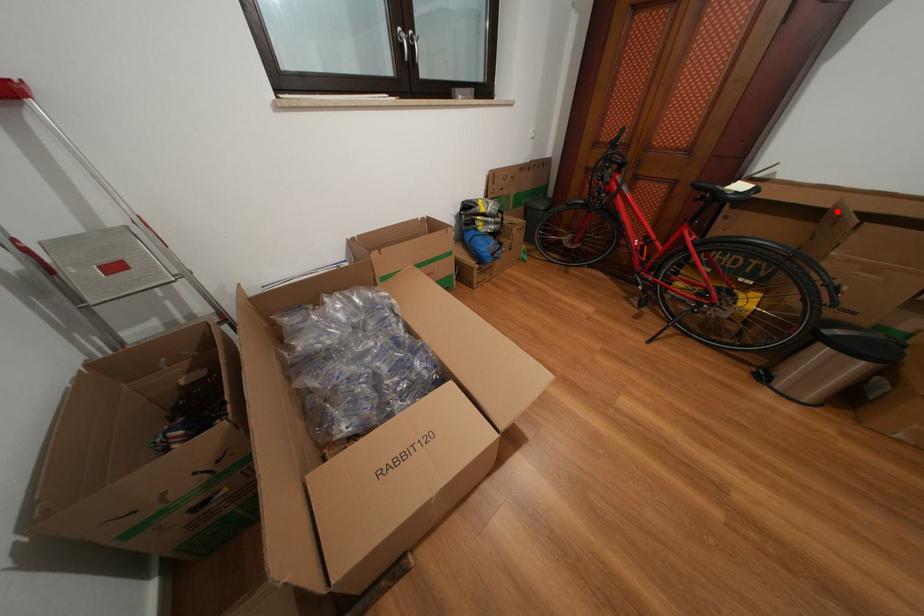
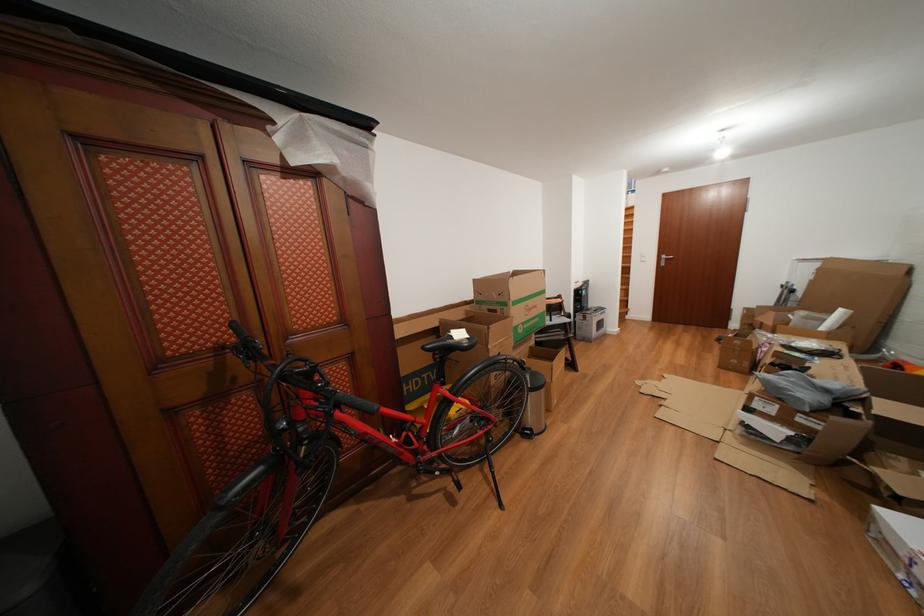
Question: I am providing you with two images of the same scene from different viewpoints. In image1, a red point is highlighted. Considering the same 3D point in image2, which of the following is correct?

Choices:
 (A) It is closer
 (B) It is farther

Answer: (A)